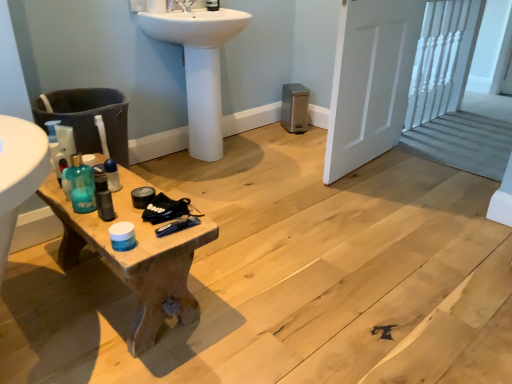
What do you see at coordinates (199, 67) in the screenshot? Image resolution: width=512 pixels, height=384 pixels. I see `white glossy sink at upper center` at bounding box center [199, 67].

How much space does matte black soap dispenser at upper center, acting as the first toiletry starting from the right, occupy horizontally?

It is 3.76 inches.

The width and height of the screenshot is (512, 384). Describe the element at coordinates (135, 257) in the screenshot. I see `woodenwoodentable at left` at that location.

What do you see at coordinates (53, 140) in the screenshot? The width and height of the screenshot is (512, 384). I see `translucent plastic bottle at left` at bounding box center [53, 140].

This screenshot has width=512, height=384. Find the location of `white glossy sink at upper center`. white glossy sink at upper center is located at coordinates (199, 67).

Considering their positions, is translucent plastic bottle at left located in front of or behind translucent plastic bottle at center, which ranks as the 1th toiletry in front-to-back order?

translucent plastic bottle at left is positioned farther from the viewer than translucent plastic bottle at center, which ranks as the 1th toiletry in front-to-back order.

Considering the sizes of translucent plastic bottle at left and translucent plastic bottle at center, the second toiletry when ordered from back to front, in the image, is translucent plastic bottle at left taller or shorter than translucent plastic bottle at center, the second toiletry when ordered from back to front,?

In the image, translucent plastic bottle at left appears to be taller than translucent plastic bottle at center, the second toiletry when ordered from back to front.

Is translucent plastic bottle at left directly adjacent to translucent plastic bottle at center, which appears as the 2th toiletry when viewed from the right?

No, translucent plastic bottle at left is not in contact with translucent plastic bottle at center, which appears as the 2th toiletry when viewed from the right.

Between translucent plastic bottle at center, the second toiletry when ordered from back to front, and white wooden door at right, which one appears on the right side from the viewer's perspective?

From the viewer's perspective, white wooden door at right appears more on the right side.

Starting from the white wooden door at right, which toiletry is the 2nd one to the left? Please provide its 2D coordinates.

[(112, 175)]

Is translucent plastic bottle at center, the second toiletry when ordered from back to front, oriented away from white wooden door at right?

No.

Can you confirm if translucent plastic bottle at center, the first toiletry ordered from the bottom, is bigger than white wooden door at right?

No, translucent plastic bottle at center, the first toiletry ordered from the bottom, is not bigger than white wooden door at right.

Considering the positions of objects white wooden door at right and matte black soap dispenser at upper center, the second toiletry positioned from the bottom, in the image provided, who is behind, white wooden door at right or matte black soap dispenser at upper center, the second toiletry positioned from the bottom,?

matte black soap dispenser at upper center, the second toiletry positioned from the bottom, is further from the camera.

Is matte black soap dispenser at upper center, acting as the first toiletry starting from the right, located within white wooden door at right?

Definitely not — matte black soap dispenser at upper center, acting as the first toiletry starting from the right, is not inside white wooden door at right.

In terms of width, does white wooden door at right look wider or thinner when compared to matte black soap dispenser at upper center, acting as the first toiletry starting from the right?

white wooden door at right is wider than matte black soap dispenser at upper center, acting as the first toiletry starting from the right.

Considering the relative positions of translucent plastic bottle at left and white wooden door at right in the image provided, is translucent plastic bottle at left to the left of white wooden door at right from the viewer's perspective?

Yes, translucent plastic bottle at left is to the left of white wooden door at right.

Are translucent plastic bottle at left and white wooden door at right making contact?

No, translucent plastic bottle at left is not in contact with white wooden door at right.

Is point (51, 125) closer to camera compared to point (353, 86)?

Yes, it is.

From the image's perspective, who appears lower, translucent plastic bottle at left or white wooden door at right?

From the image's view, translucent plastic bottle at left is below.

Looking at their sizes, would you say translucent plastic bottle at center, the first toiletry ordered from the bottom, is wider or thinner than translucent plastic bottle at left?

translucent plastic bottle at center, the first toiletry ordered from the bottom, is wider than translucent plastic bottle at left.

Does translucent plastic bottle at center, the 1th toiletry from the left, lie in front of translucent plastic bottle at left?

Yes, translucent plastic bottle at center, the 1th toiletry from the left, is closer to the camera.

How many degrees apart are the facing directions of translucent plastic bottle at center, the first toiletry ordered from the bottom, and translucent plastic bottle at left?

They differ by 87.5 degrees in their facing directions.

From a real-world perspective, is translucent plastic bottle at center, the first toiletry ordered from the bottom, physically located above or below translucent plastic bottle at left?

translucent plastic bottle at center, the first toiletry ordered from the bottom, is below translucent plastic bottle at left.

Can you tell me how much translucent plastic bottle at center, which ranks as the 1th toiletry in front-to-back order, and woodenwoodentable at left differ in facing direction?

They differ by 92.6 degrees in their facing directions.

Which is closer, (119, 180) or (137, 218)?

Positioned in front is point (137, 218).

From a real-world perspective, does translucent plastic bottle at center, which appears as the 2th toiletry when viewed from the right, sit lower than woodenwoodentable at left?

No.

Is white wooden door at right surrounded by white glossy sink at upper center?

No, white wooden door at right is not surrounded by white glossy sink at upper center.

Locate an element on the screen. The image size is (512, 384). screen door below the white glossy sink at upper center (from the image's perspective) is located at coordinates (370, 81).

Considering the relative sizes of white glossy sink at upper center and white wooden door at right in the image provided, is white glossy sink at upper center shorter than white wooden door at right?

Indeed, white glossy sink at upper center has a lesser height compared to white wooden door at right.

Relative to white wooden door at right, is white glossy sink at upper center in front or behind?

Visually, white glossy sink at upper center is located behind white wooden door at right.

Identify the location of toiletry below the translucent plastic bottle at left (from a real-world perspective). (112, 175).

Where is `screen door above the translucent plastic bottle at center, which appears as the 2th toiletry when viewed from the right (from a real-world perspective)`? screen door above the translucent plastic bottle at center, which appears as the 2th toiletry when viewed from the right (from a real-world perspective) is located at coordinates (370, 81).

Considering their positions, is woodenwoodentable at left positioned closer to matte black soap dispenser at upper center, the 1th toiletry in the back-to-front sequence, than translucent plastic bottle at center, the 1th toiletry from the left?

Based on the image, translucent plastic bottle at center, the 1th toiletry from the left, appears to be nearer to matte black soap dispenser at upper center, the 1th toiletry in the back-to-front sequence.

Which object lies nearer to the anchor point white glossy sink at upper center, white wooden door at right or translucent plastic bottle at left?

white wooden door at right.

Considering their positions, is woodenwoodentable at left positioned closer to translucent plastic bottle at center, the second toiletry when ordered from back to front, than white wooden door at right?

Among the two, woodenwoodentable at left is located nearer to translucent plastic bottle at center, the second toiletry when ordered from back to front.

Based on their spatial positions, is woodenwoodentable at left or white wooden door at right further from matte black soap dispenser at upper center, the 2th toiletry from the left?

The object further to matte black soap dispenser at upper center, the 2th toiletry from the left, is woodenwoodentable at left.

Based on their spatial positions, is translucent plastic bottle at left or white wooden door at right closer to white glossy sink at upper center?

Based on the image, white wooden door at right appears to be nearer to white glossy sink at upper center.

In the scene shown: Based on their spatial positions, is translucent plastic bottle at left or woodenwoodentable at left closer to matte black soap dispenser at upper center, acting as the second toiletry starting from the front?

The object closer to matte black soap dispenser at upper center, acting as the second toiletry starting from the front, is translucent plastic bottle at left.

Looking at the image, which one is located further to matte black soap dispenser at upper center, the 1th toiletry in the back-to-front sequence, translucent plastic bottle at center, the first toiletry ordered from the bottom, or white wooden door at right?

translucent plastic bottle at center, the first toiletry ordered from the bottom, is further to matte black soap dispenser at upper center, the 1th toiletry in the back-to-front sequence.

When comparing their distances from translucent plastic bottle at left, does white glossy sink at upper center or translucent plastic bottle at center, the 1th toiletry from the left, seem closer?

translucent plastic bottle at center, the 1th toiletry from the left, is positioned closer to the anchor translucent plastic bottle at left.

Image resolution: width=512 pixels, height=384 pixels. I want to click on toiletry positioned between woodenwoodentable at left and white glossy sink at upper center from near to far, so click(x=112, y=175).

What are the coordinates of `toiletry between matte black soap dispenser at upper center, acting as the second toiletry starting from the front, and woodenwoodentable at left from top to bottom` in the screenshot? It's located at (112, 175).

Where is `toiletry positioned between woodenwoodentable at left and translucent plastic bottle at left from near to far`? This screenshot has height=384, width=512. toiletry positioned between woodenwoodentable at left and translucent plastic bottle at left from near to far is located at coordinates (112, 175).

Locate an element on the screen. The image size is (512, 384). table between translucent plastic bottle at center, positioned as the second toiletry in top-to-bottom order, and white wooden door at right from left to right is located at coordinates (135, 257).